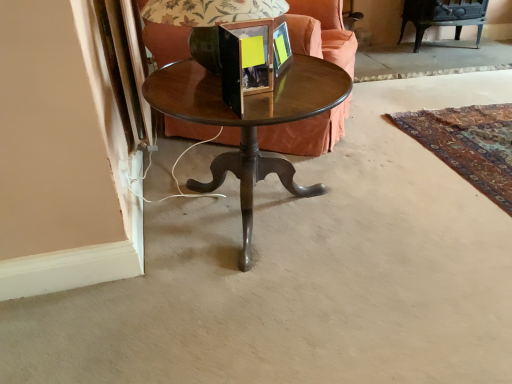
The width and height of the screenshot is (512, 384). Identify the location of vacant area that lies between wooden round table at center and velvet orange couch at center. (313, 165).